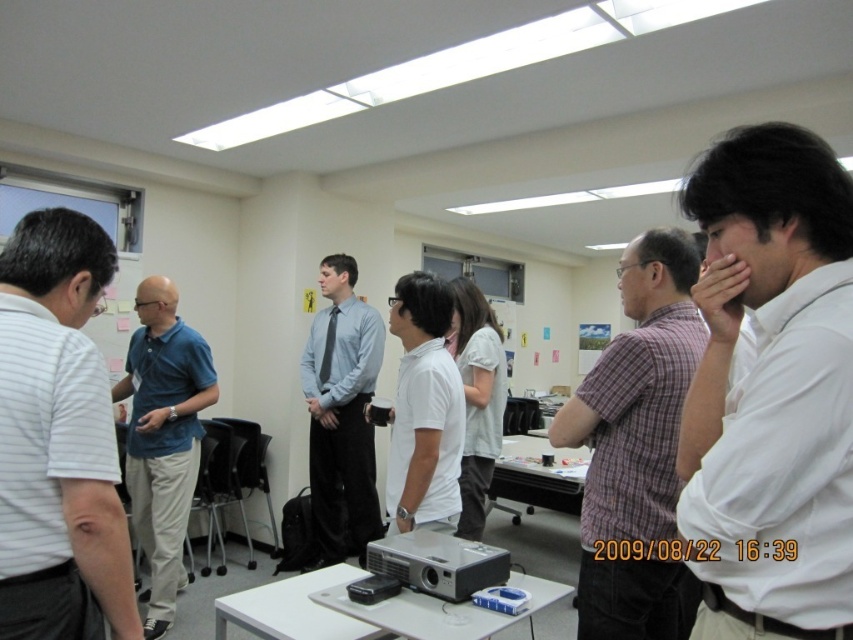
You are a photographer positioned at the back of the room. You want to take a photo of the silver metallic projector at center without the white shirt at right blocking the view. Is the projector visible from your position?

The white shirt at right is much taller than the silver metallic projector at center, so the white shirt at right would block the view of the silver metallic projector at center from your position.